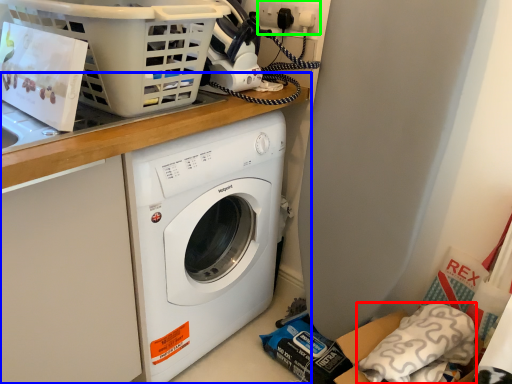
Question: Considering the real-world distances, which object is farthest from pillow (highlighted by a red box)? counter top (highlighted by a blue box) or electric outlet (highlighted by a green box)?

Choices:
 (A) counter top
 (B) electric outlet

Answer: (B)